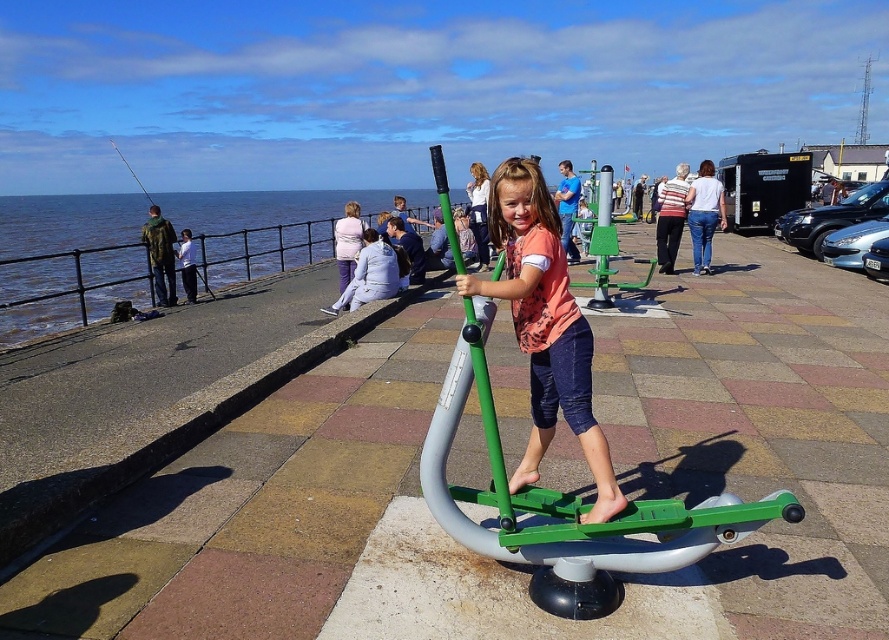
Who is higher up, matte orange shirt at center or green matte pole at center?

matte orange shirt at center is above.

Is point (577, 337) closer to camera compared to point (482, 493)?

Yes, it is.

What are the coordinates of `matte orange shirt at center` in the screenshot? It's located at (543, 326).